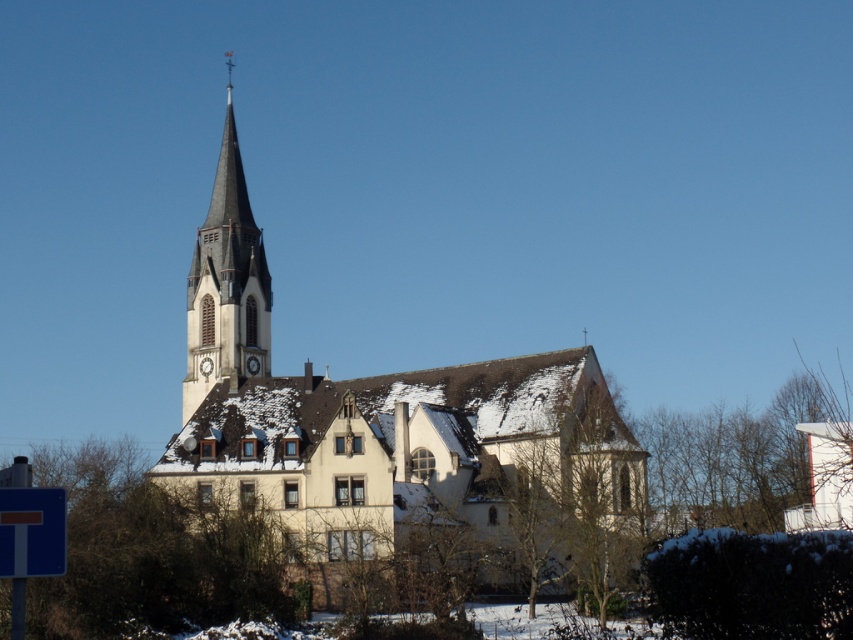
You are standing at point A, which is at coordinates (395, 433). What object is located exactly at your current position?

The white stone church at center is located exactly at point A with coordinates (395, 433).